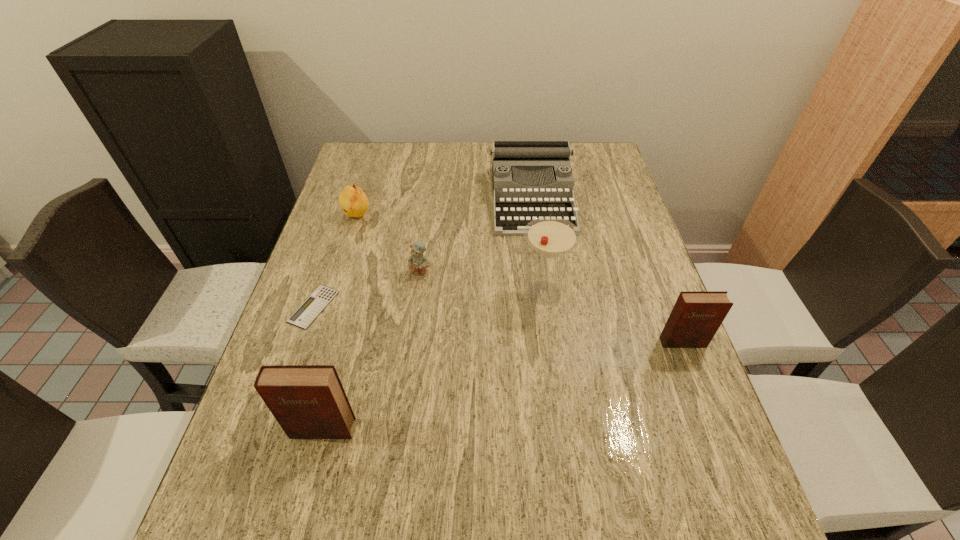
The width and height of the screenshot is (960, 540). I want to click on free region located on the front-facing side of the teddy bear, so click(418, 300).

Identify the location of free location located on the typing side of the typewriter. This screenshot has width=960, height=540. (553, 352).

The width and height of the screenshot is (960, 540). In order to click on vacant area located 0.100m on the left of the martini in this screenshot , I will do `click(478, 293)`.

I want to click on vacant point located 0.280m on the front of the shortest object, so click(264, 452).

What are the coordinates of `object at the far edge` in the screenshot? It's located at (524, 157).

The width and height of the screenshot is (960, 540). Identify the location of object that is at the near edge. (308, 401).

The width and height of the screenshot is (960, 540). Find the location of `diary that is at the left edge`. diary that is at the left edge is located at coordinates (308, 401).

Identify the location of pear that is at the left edge. (353, 201).

Image resolution: width=960 pixels, height=540 pixels. Identify the location of calculator that is at the left edge. (307, 312).

Where is `diary located at the right edge`? diary located at the right edge is located at coordinates (696, 316).